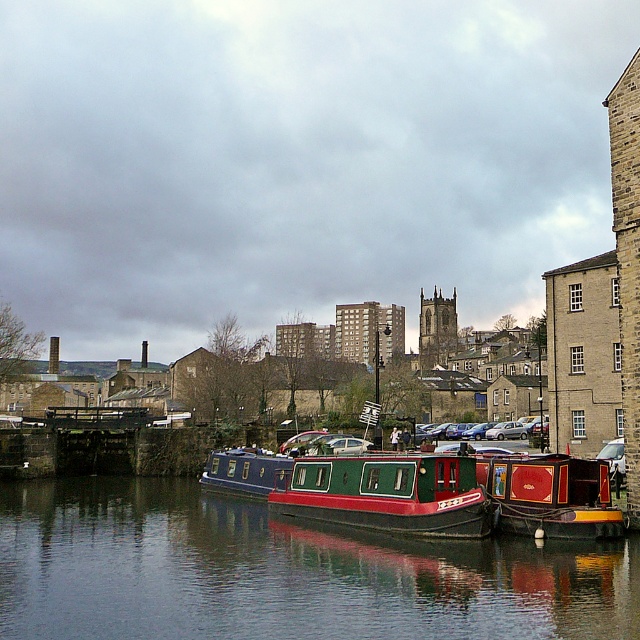
In the scene shown: Does red glossy barge at center appear over red polished wood barge at lower right?

Incorrect, red glossy barge at center is not positioned above red polished wood barge at lower right.

Is point (333, 499) less distant than point (540, 490)?

No, (333, 499) is further to viewer.

Where is `red glossy barge at center`? red glossy barge at center is located at coordinates (387, 493).

Can you confirm if smooth black water at center is taller than red polished wood barge at lower right?

No, smooth black water at center is not taller than red polished wood barge at lower right.

The image size is (640, 640). Describe the element at coordinates (282, 572) in the screenshot. I see `smooth black water at center` at that location.

Where is `smooth black water at center`? This screenshot has width=640, height=640. smooth black water at center is located at coordinates (282, 572).

Can you confirm if smooth black water at center is thinner than red glossy barge at center?

No, smooth black water at center is not thinner than red glossy barge at center.

Who is shorter, smooth black water at center or red glossy barge at center?

Standing shorter between the two is smooth black water at center.

This screenshot has height=640, width=640. What do you see at coordinates (282, 572) in the screenshot? I see `smooth black water at center` at bounding box center [282, 572].

Identify the location of smooth black water at center. The height and width of the screenshot is (640, 640). (282, 572).